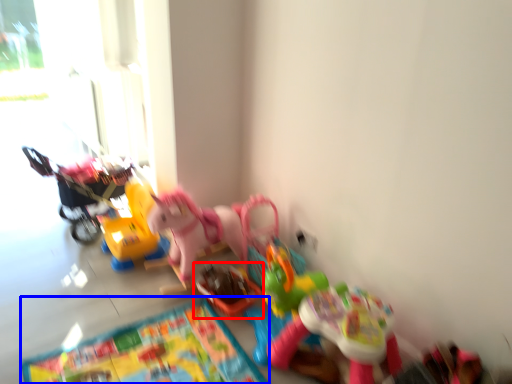
Question: Which point is further to the camera, toy (highlighted by a red box) or mat (highlighted by a blue box)?

Choices:
 (A) toy
 (B) mat

Answer: (A)